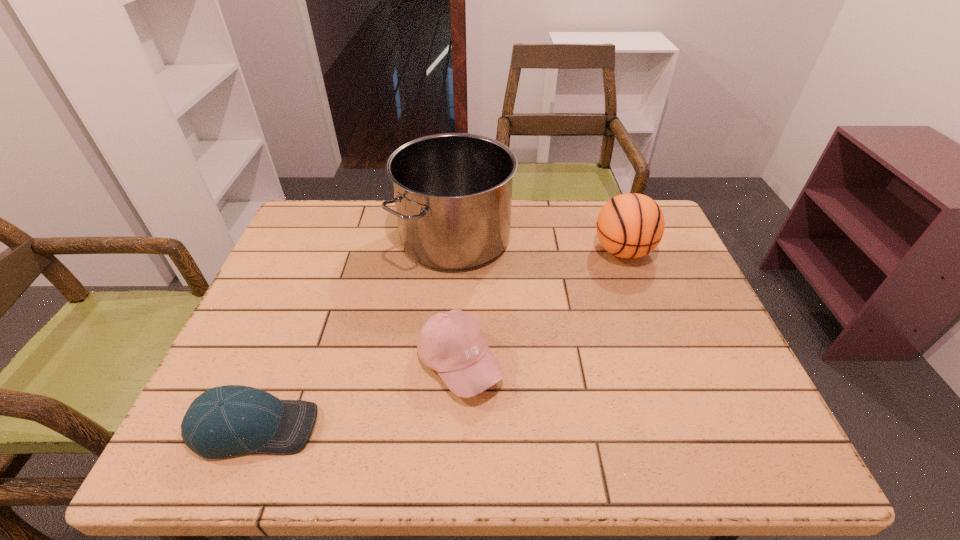
Image resolution: width=960 pixels, height=540 pixels. In order to click on the tallest object in this screenshot , I will do `click(452, 192)`.

This screenshot has height=540, width=960. Identify the location of the rightmost object. (631, 225).

Find the location of a particular element. the second tallest object is located at coordinates (631, 225).

This screenshot has width=960, height=540. I want to click on the taller baseball cap, so click(452, 343).

Where is `the right baseball cap`? The height and width of the screenshot is (540, 960). the right baseball cap is located at coordinates pos(452,343).

Locate an element on the screen. This screenshot has width=960, height=540. the leftmost object is located at coordinates (224, 421).

I want to click on the shorter baseball cap, so click(224, 421).

Locate an element on the screen. The image size is (960, 540). vacant space located 0.260m on the right of the tallest object is located at coordinates (600, 238).

Image resolution: width=960 pixels, height=540 pixels. I want to click on free space located 0.130m on the front of the rightmost object, so click(x=643, y=306).

I want to click on vacant space located 0.320m on the front-facing side of the right baseball cap, so click(646, 363).